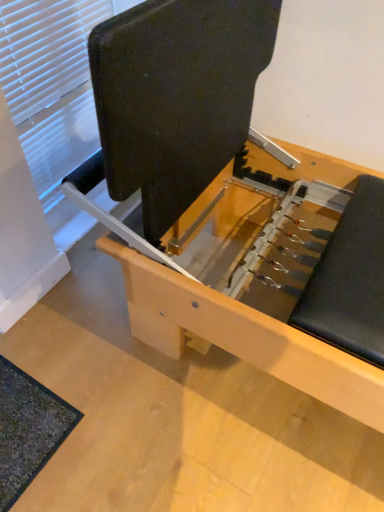
Question: Is white matte window at upper left shorter than dark green textured mat at lower left?

Choices:
 (A) yes
 (B) no

Answer: (B)

Question: Can you see white matte window at upper left touching dark green textured mat at lower left?

Choices:
 (A) no
 (B) yes

Answer: (A)

Question: Is white matte window at upper left facing away from dark green textured mat at lower left?

Choices:
 (A) no
 (B) yes

Answer: (A)

Question: Considering the relative positions of white matte window at upper left and dark green textured mat at lower left in the image provided, is white matte window at upper left to the right of dark green textured mat at lower left from the viewer's perspective?

Choices:
 (A) no
 (B) yes

Answer: (B)

Question: Considering the relative sizes of white matte window at upper left and dark green textured mat at lower left in the image provided, is white matte window at upper left taller than dark green textured mat at lower left?

Choices:
 (A) no
 (B) yes

Answer: (B)

Question: Is white matte window at upper left not near dark green textured mat at lower left?

Choices:
 (A) no
 (B) yes

Answer: (A)

Question: Does matte black bench at center have a lesser width compared to dark green textured mat at lower left?

Choices:
 (A) no
 (B) yes

Answer: (A)

Question: Considering the relative sizes of matte black bench at center and dark green textured mat at lower left in the image provided, is matte black bench at center shorter than dark green textured mat at lower left?

Choices:
 (A) no
 (B) yes

Answer: (A)

Question: From a real-world perspective, is matte black bench at center physically below dark green textured mat at lower left?

Choices:
 (A) no
 (B) yes

Answer: (B)

Question: Considering the relative sizes of matte black bench at center and dark green textured mat at lower left in the image provided, is matte black bench at center smaller than dark green textured mat at lower left?

Choices:
 (A) no
 (B) yes

Answer: (A)

Question: From the image's perspective, is matte black bench at center beneath dark green textured mat at lower left?

Choices:
 (A) yes
 (B) no

Answer: (B)

Question: Can you confirm if matte black bench at center is taller than dark green textured mat at lower left?

Choices:
 (A) no
 (B) yes

Answer: (B)

Question: From the image's perspective, is matte black bench at center below white matte window at upper left?

Choices:
 (A) no
 (B) yes

Answer: (B)